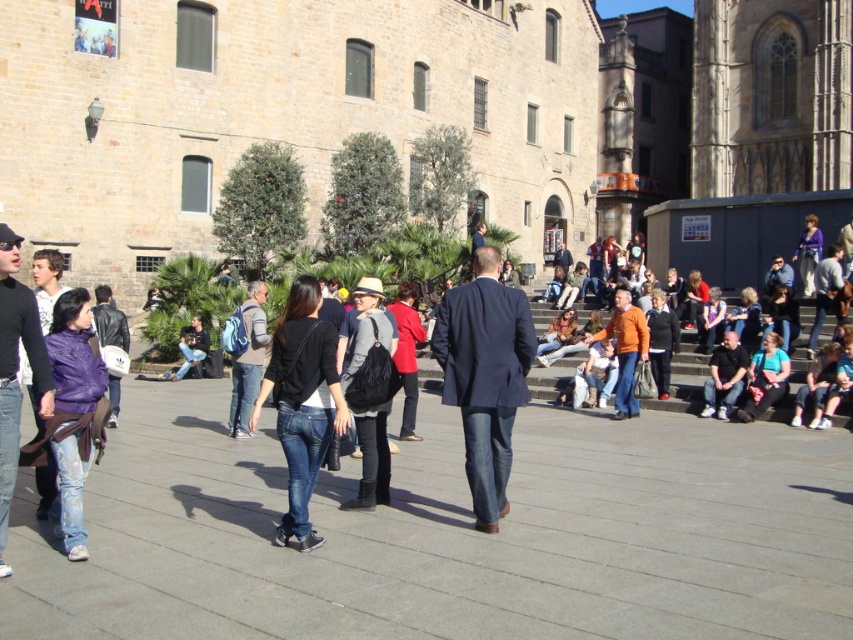
Question: Estimate the real-world distances between objects in this image. Which object is closer to the navy blue suit at center?

Choices:
 (A) orange matte jacket at center
 (B) brown stone church at upper right

Answer: (A)

Question: Which of the following is the closest to the observer?

Choices:
 (A) (245, 424)
 (B) (851, 19)
 (C) (6, 480)
 (D) (624, 332)

Answer: (C)

Question: Which point appears closest to the camera in this image?

Choices:
 (A) (799, 56)
 (B) (735, 388)
 (C) (0, 468)

Answer: (C)

Question: Can you confirm if beige stone church at upper center is wider than denim jeans at left?

Choices:
 (A) yes
 (B) no

Answer: (A)

Question: Where is brown stone church at upper right located in relation to orange matte jacket at center in the image?

Choices:
 (A) left
 (B) right

Answer: (B)

Question: Can you confirm if beige stone church at upper center is bigger than navy blue suit at center?

Choices:
 (A) no
 (B) yes

Answer: (B)